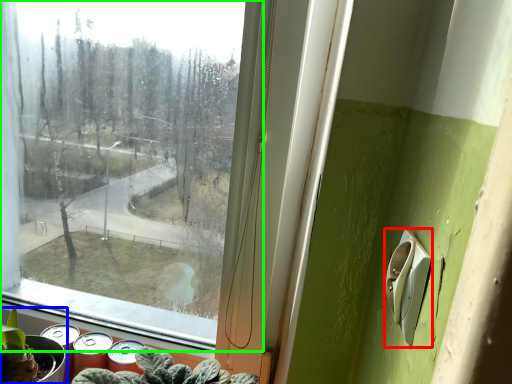
Question: Which object is the farthest from light switch (highlighted by a red box)? Choose among these: houseplant (highlighted by a blue box) or window (highlighted by a green box).

Choices:
 (A) houseplant
 (B) window

Answer: (B)